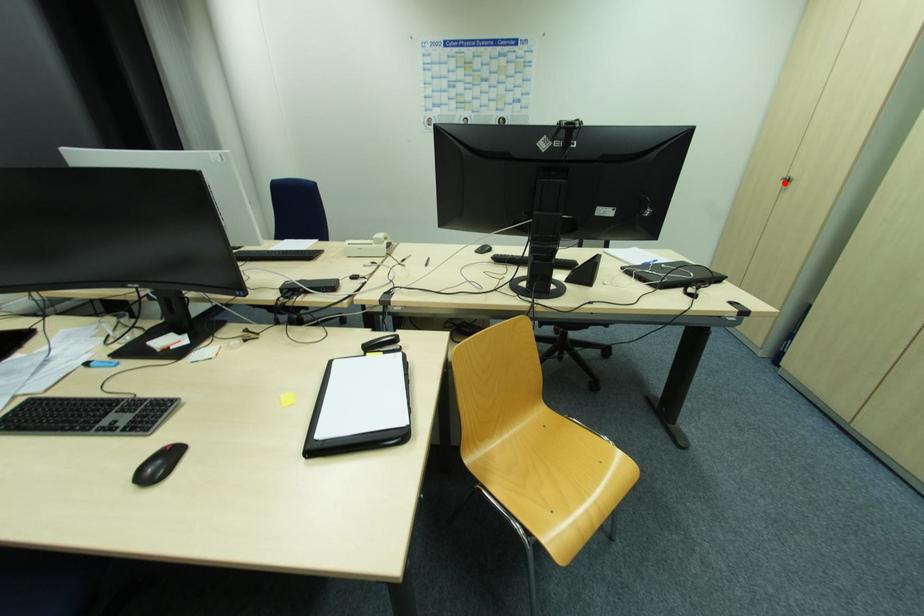
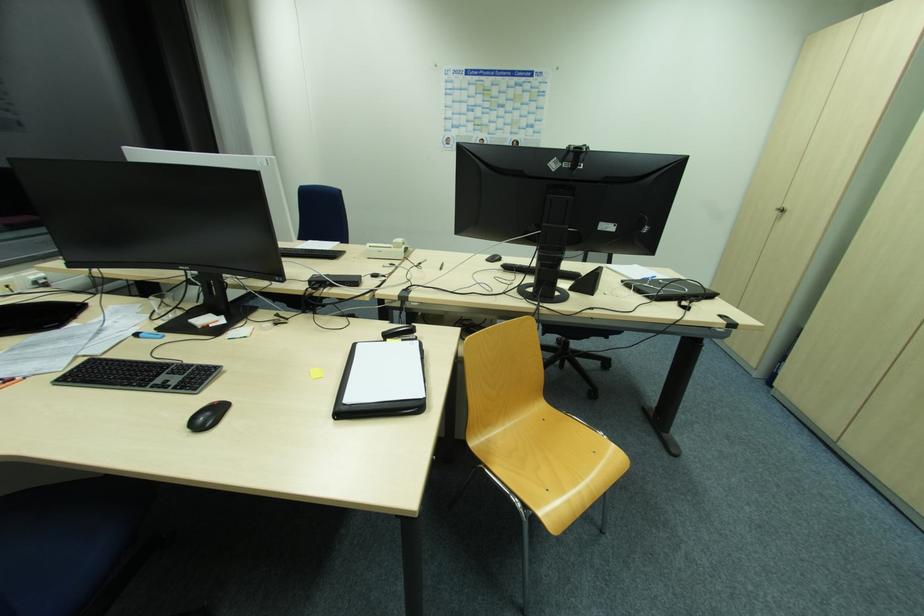
In the second image, find the point that corresponds to the highlighted location in the first image.

(779, 214)